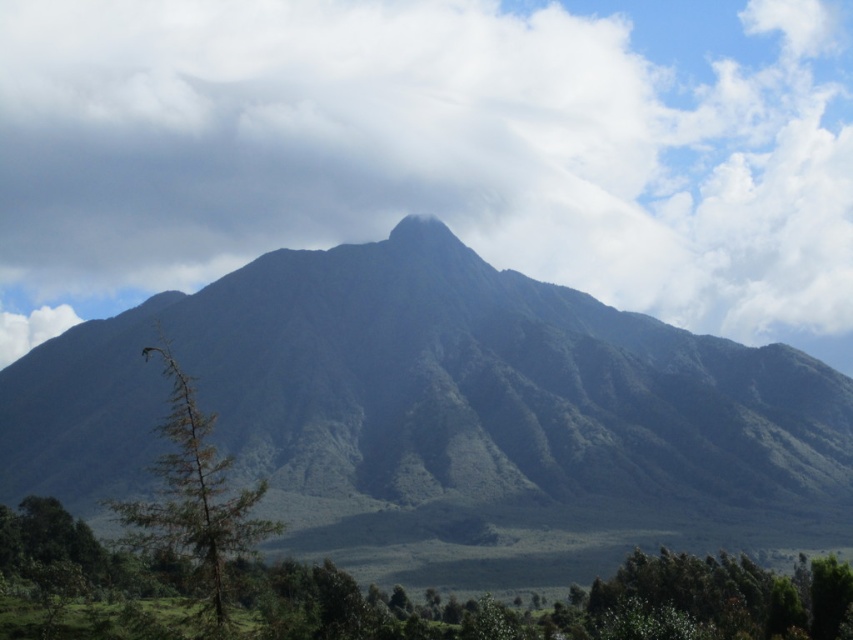
You are an environmental scientist assessing the landscape. You observe the white fluffy cloud at upper center and the green matte tree at left. Which object occupies a larger area in the image?

The white fluffy cloud at upper center is bigger than the green matte tree at left, so it occupies a larger area in the image.

You are standing at the point marked by the coordinate point at (440,410) in the image. What is the immediate terrain feature under your feet?

The point at (440,410) is located on the green grassy mountain at center, so the immediate terrain feature under your feet is green grassy mountain at center.

You are a hiker planning to take a photo of the green matte mountain peak at center. However, there is a white fluffy cloud at upper center in the way. Can you determine if the cloud is blocking the mountain peak from your view?

The white fluffy cloud at upper center is located above the green matte mountain peak at center, so it is blocking the mountain peak from your view.